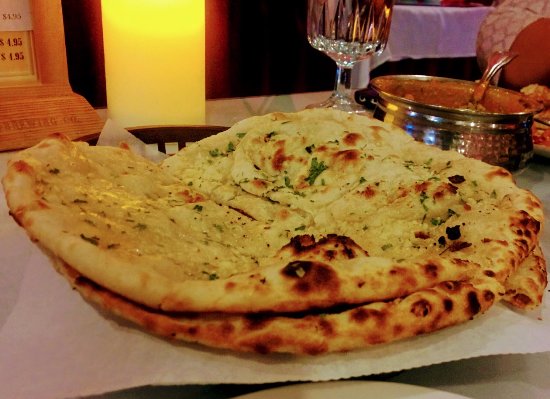
Locate an element on the screen. Image resolution: width=550 pixels, height=399 pixels. basket is located at coordinates pyautogui.click(x=189, y=134).